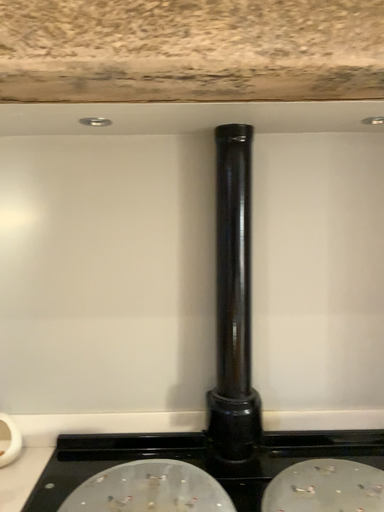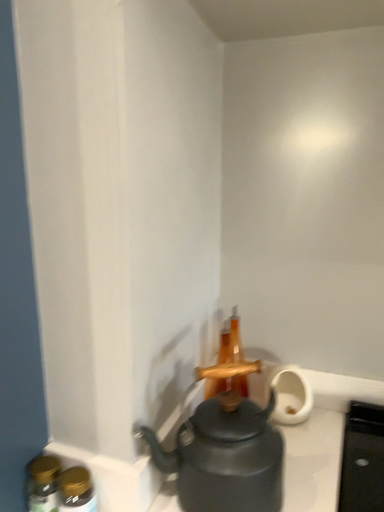
Question: How did the camera likely rotate when shooting the video?

Choices:
 (A) rotated left
 (B) rotated right

Answer: (A)